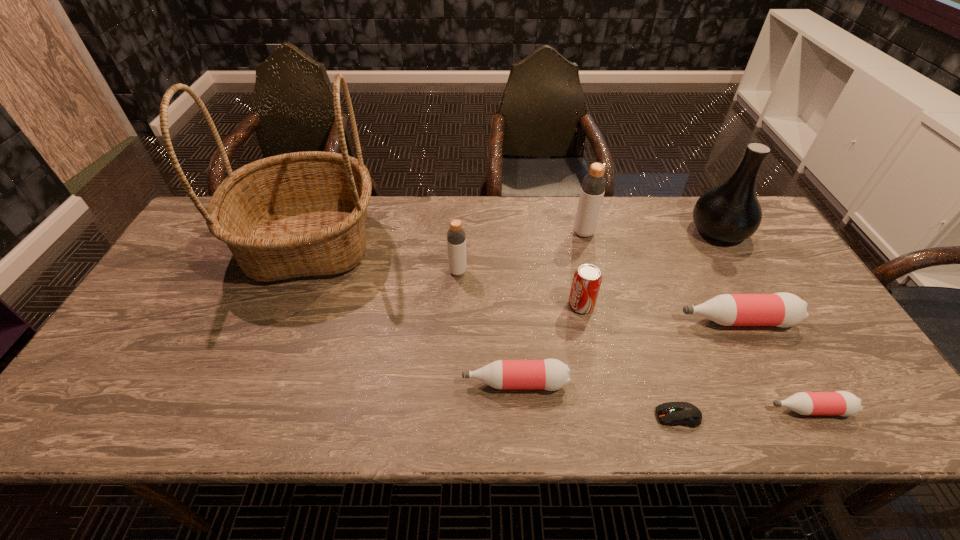
The height and width of the screenshot is (540, 960). Find the location of `the second nearest bottle`. the second nearest bottle is located at coordinates (550, 374).

The height and width of the screenshot is (540, 960). What are the coordinates of `the seventh farthest object` in the screenshot? It's located at (550, 374).

What are the coordinates of `the nearest bottle` in the screenshot? It's located at (843, 403).

Image resolution: width=960 pixels, height=540 pixels. I want to click on the nearest pink bottle, so click(843, 403).

This screenshot has width=960, height=540. What are the coordinates of `the shortest object` in the screenshot? It's located at (674, 413).

Identify the location of computer equipment. Image resolution: width=960 pixels, height=540 pixels. (674, 413).

I want to click on vacant space located 0.340m on the front of the basket, so click(241, 417).

At what (x,y) coordinates should I click in order to perform the action: click on vacant space located on the left of the eighth shortest object. Please return your answer as a coordinate pair (x, y). The width and height of the screenshot is (960, 540). Looking at the image, I should click on (609, 231).

At what (x,y) coordinates should I click in order to perform the action: click on vacant space situated on the front of the tallest bottle. Please return your answer as a coordinate pair (x, y). Looking at the image, I should click on (588, 253).

Find the location of a particular element. This screenshot has height=540, width=960. vacant position located on the left of the smaller gray bottle is located at coordinates coord(324,271).